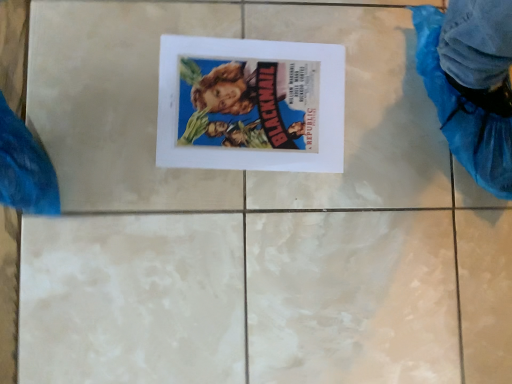
Find the location of a particular element. The width and height of the screenshot is (512, 384). blank space above matte paper poster at center (from a real-world perspective) is located at coordinates (259, 108).